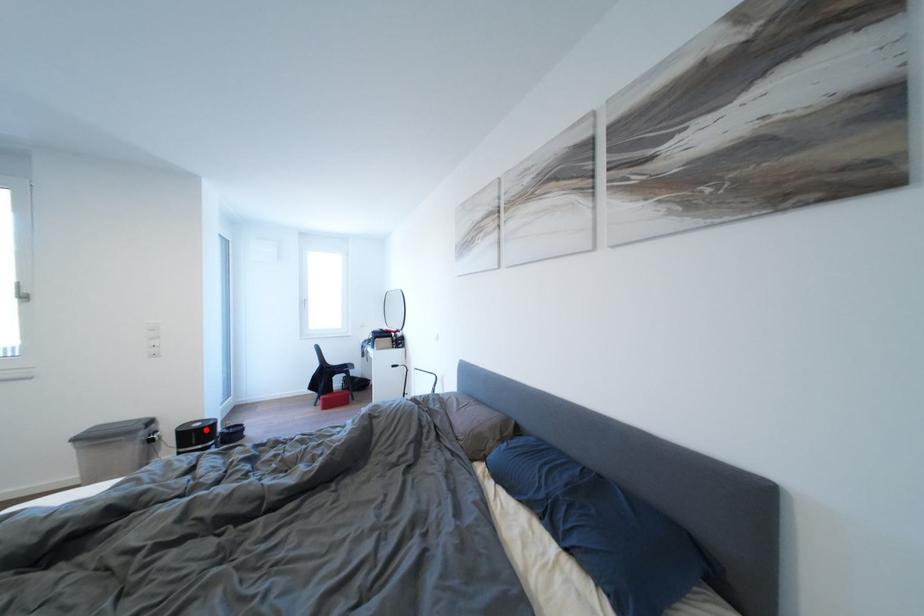
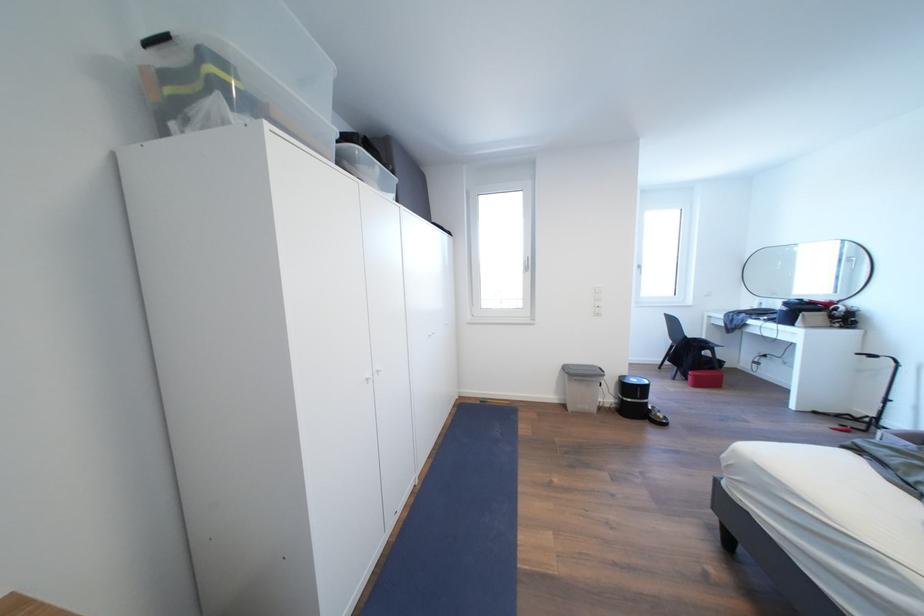
Find the pixel in the second image that matches the highlighted location in the first image.

(641, 386)